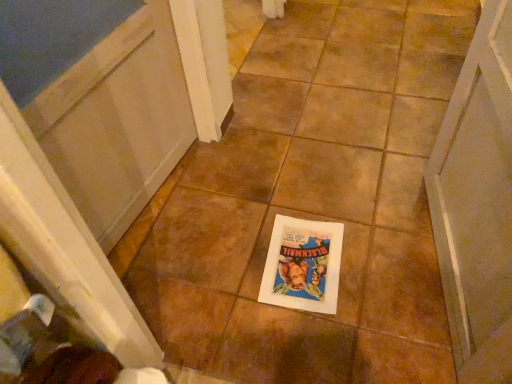
Where is `empty space that is ontop of matte paper book at center (from a real-world perspective)`? Image resolution: width=512 pixels, height=384 pixels. empty space that is ontop of matte paper book at center (from a real-world perspective) is located at coordinates (303, 261).